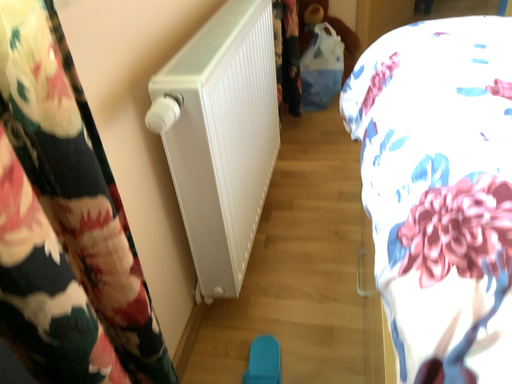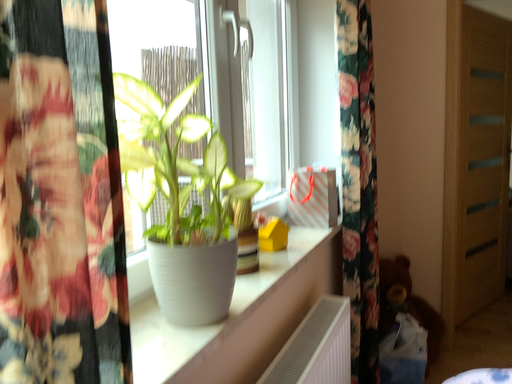
Question: Which way did the camera rotate in the video?

Choices:
 (A) rotated right
 (B) rotated left

Answer: (B)